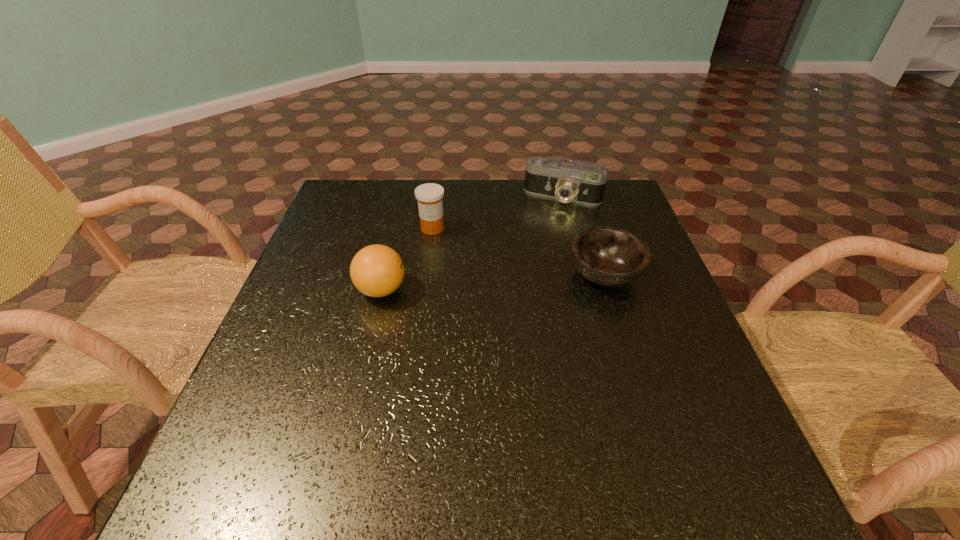
At what (x,y) coordinates should I click in order to perform the action: click on the leftmost object. Please return your answer as a coordinate pair (x, y). This screenshot has height=540, width=960. Looking at the image, I should click on (377, 270).

Identify the location of bowl. (607, 256).

Where is `camera`? The width and height of the screenshot is (960, 540). camera is located at coordinates (577, 181).

You are a GUI agent. You are given a task and a screenshot of the screen. Output one action in this format:
    pyautogui.click(x=<x>, y=<y>)
    Task: Click on the third object from right to left
    
    Given the screenshot: What is the action you would take?
    pyautogui.click(x=430, y=204)

This screenshot has width=960, height=540. What are the coordinates of `the third nearest object` in the screenshot? It's located at (430, 204).

At what (x,y) coordinates should I click in order to perform the action: click on free space located 0.300m on the side with brand of the leftmost object. Please return your answer as a coordinate pair (x, y). Looking at the image, I should click on (534, 290).

The height and width of the screenshot is (540, 960). Identify the location of vacant area situated 0.320m on the back of the bowl. (577, 188).

Image resolution: width=960 pixels, height=540 pixels. What are the coordinates of `vacant space located on the lens of the farthest object` in the screenshot? It's located at (525, 269).

Where is `vacant region located on the lens of the farthest object`? Image resolution: width=960 pixels, height=540 pixels. vacant region located on the lens of the farthest object is located at coordinates click(543, 229).

Locate an element on the screen. The height and width of the screenshot is (540, 960). vacant space located 0.180m on the lens of the farthest object is located at coordinates (537, 244).